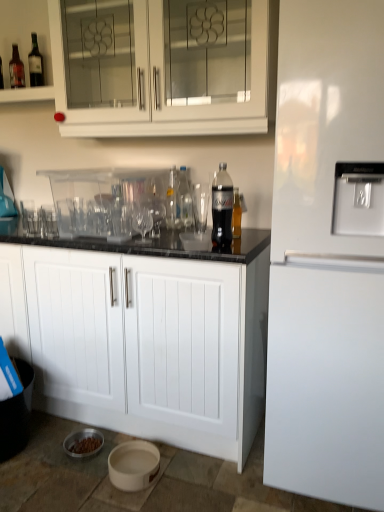
Identify the location of free spot in front of transparent glass shot glass at center, arranged as the second shot glass when viewed from the right. This screenshot has height=512, width=384. (51, 239).